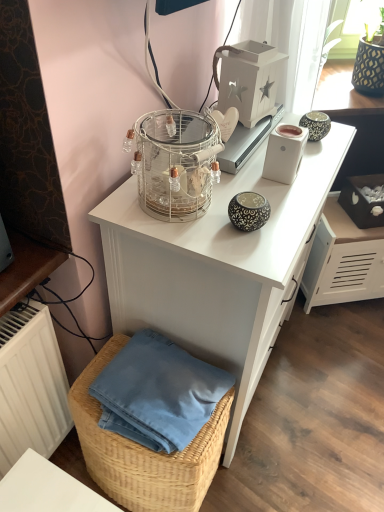
Where is `vacant space in front of white matte rectangular device at upper center, the 2th appliance when ordered from top to bottom`? The height and width of the screenshot is (512, 384). vacant space in front of white matte rectangular device at upper center, the 2th appliance when ordered from top to bottom is located at coordinates (283, 200).